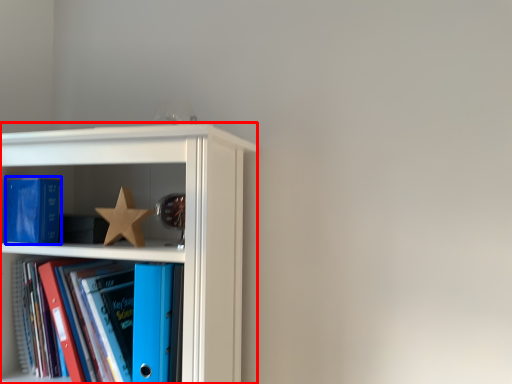
Question: Which object appears farthest to the camera in this image, shelf (highlighted by a red box) or paperback book (highlighted by a blue box)?

Choices:
 (A) shelf
 (B) paperback book

Answer: (B)